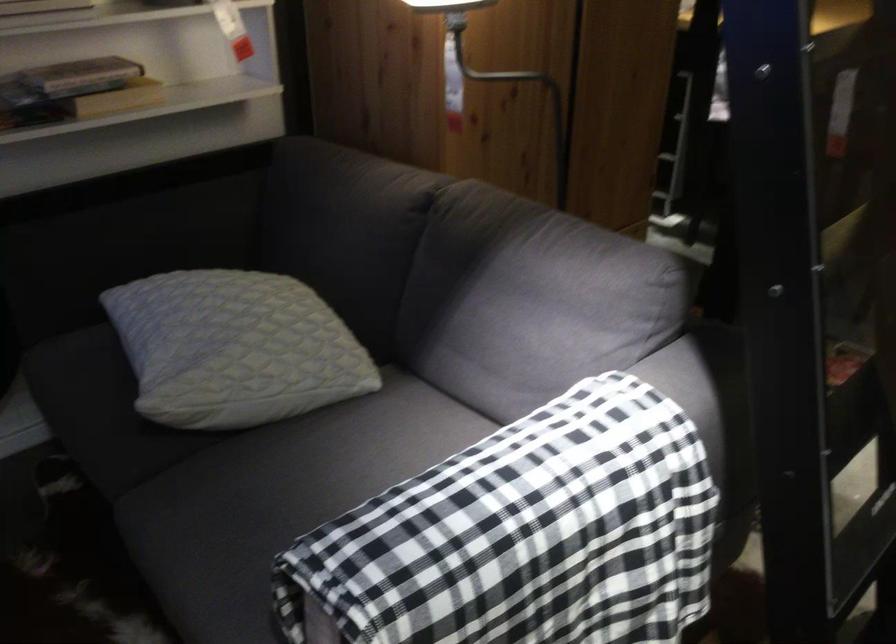
The width and height of the screenshot is (896, 644). What do you see at coordinates (500, 71) in the screenshot?
I see `the black lamp arm` at bounding box center [500, 71].